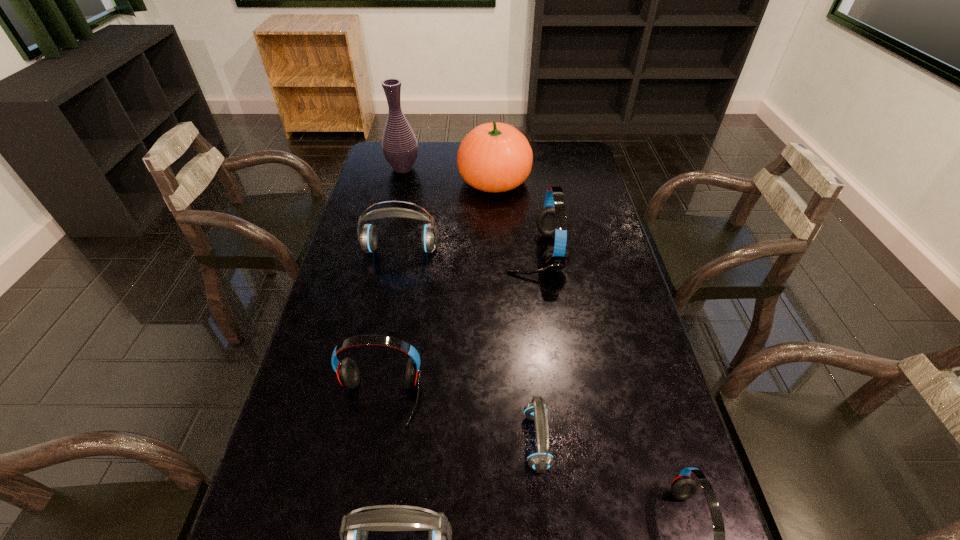
Locate an element on the screen. Image resolution: width=960 pixels, height=540 pixels. pumpkin that is at the far edge is located at coordinates (494, 157).

At what (x,y) coordinates should I click in order to perform the action: click on vase positioned at the left edge. Please return your answer as a coordinate pair (x, y). This screenshot has width=960, height=540. Looking at the image, I should click on (399, 144).

Find the location of a particular element. The height and width of the screenshot is (540, 960). object present at the far left corner is located at coordinates (399, 144).

In the image, there is a desktop. Identify the location of vacant space at the far edge. pos(429,153).

Locate an element on the screen. Image resolution: width=960 pixels, height=540 pixels. vacant region at the left edge of the desktop is located at coordinates (389, 243).

In the image, there is a desktop. Where is `vacant area at the right edge`? This screenshot has height=540, width=960. vacant area at the right edge is located at coordinates pos(594,295).

At what (x,y) coordinates should I click in order to perform the action: click on vacant area at the far right corner of the desktop. Please return your answer as a coordinate pair (x, y). The width and height of the screenshot is (960, 540). Looking at the image, I should click on (553, 144).

At what (x,y) coordinates should I click in order to perform the action: click on free space between the tallest object and the rightmost blue headset. Please return your answer as a coordinate pair (x, y). The height and width of the screenshot is (540, 960). Looking at the image, I should click on (470, 304).

Where is `free space between the tallest headset and the vase`? free space between the tallest headset and the vase is located at coordinates (468, 210).

Locate an element on the screen. This screenshot has height=540, width=960. free space that is in between the farthest blue headset and the pumpkin is located at coordinates click(x=447, y=215).